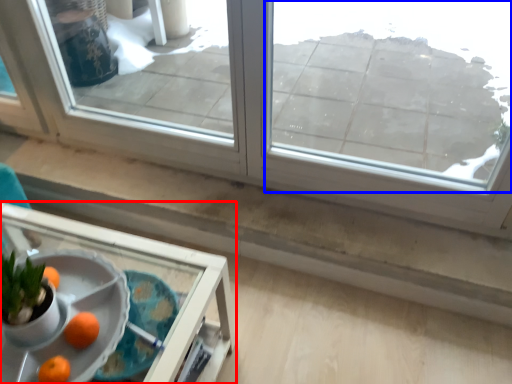
Question: Among these objects, which one is farthest to the camera, table (highlighted by a red box) or window (highlighted by a blue box)?

Choices:
 (A) table
 (B) window

Answer: (B)